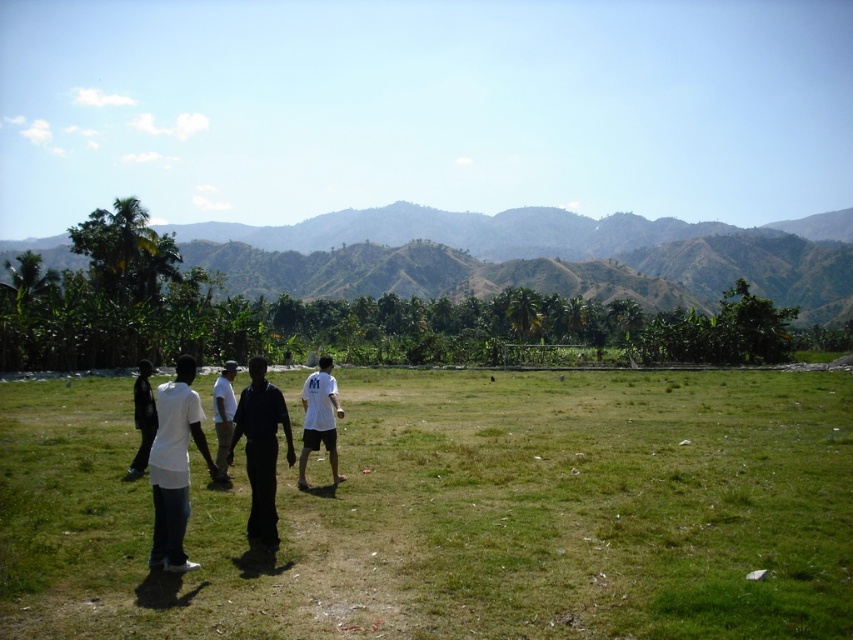
Which of these two, green grass at lower left or white matte shirt at lower left, stands taller?

white matte shirt at lower left is taller.

Which is in front, point (505, 522) or point (149, 465)?

Point (149, 465) is more forward.

Who is more forward, (x=258, y=573) or (x=155, y=451)?

Point (x=258, y=573) is more forward.

Image resolution: width=853 pixels, height=640 pixels. I want to click on green grass at lower left, so click(x=457, y=513).

Can you confirm if green leafy mountain at center is wider than white cotton shirt at center?

Yes, green leafy mountain at center is wider than white cotton shirt at center.

Does green leafy mountain at center have a smaller size compared to white cotton shirt at center?

Incorrect, green leafy mountain at center is not smaller in size than white cotton shirt at center.

Between point (637, 237) and point (213, 387), which one is positioned behind?

Positioned behind is point (637, 237).

At what (x,y) coordinates should I click in order to perform the action: click on green leafy mountain at center. Please return your answer as a coordinate pair (x, y). This screenshot has height=640, width=853. Looking at the image, I should click on (531, 257).

This screenshot has height=640, width=853. What do you see at coordinates (531, 257) in the screenshot?
I see `green leafy mountain at center` at bounding box center [531, 257].

This screenshot has height=640, width=853. I want to click on green leafy mountain at center, so click(x=531, y=257).